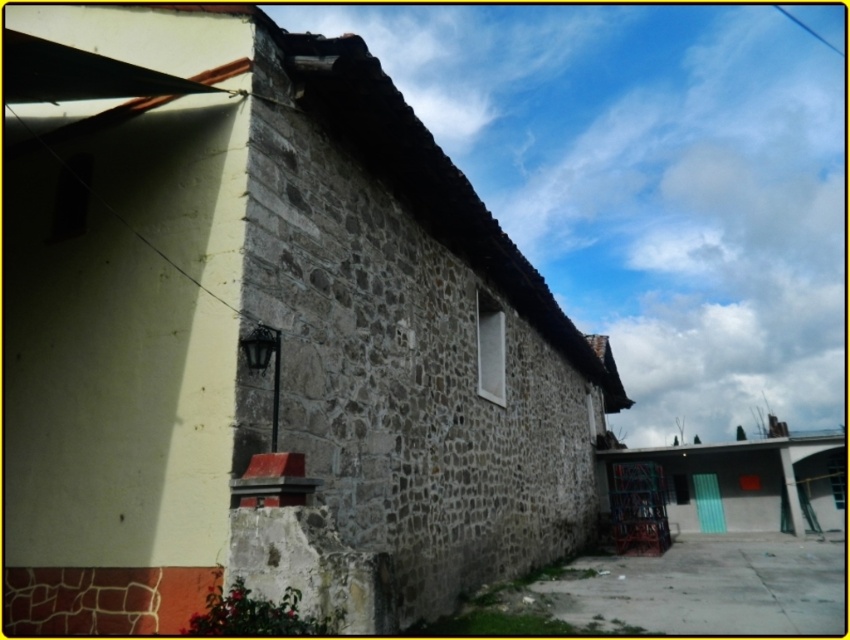
Question: Is stone wall at center to the right of green painted wood hut at lower right from the viewer's perspective?

Choices:
 (A) no
 (B) yes

Answer: (A)

Question: Considering the relative positions of stone wall at center and green painted wood hut at lower right in the image provided, where is stone wall at center located with respect to green painted wood hut at lower right?

Choices:
 (A) right
 (B) left

Answer: (B)

Question: Is stone wall at center positioned at the back of green painted wood hut at lower right?

Choices:
 (A) no
 (B) yes

Answer: (A)

Question: Among these objects, which one is nearest to the camera?

Choices:
 (A) green painted wood hut at lower right
 (B) stone wall at center

Answer: (B)